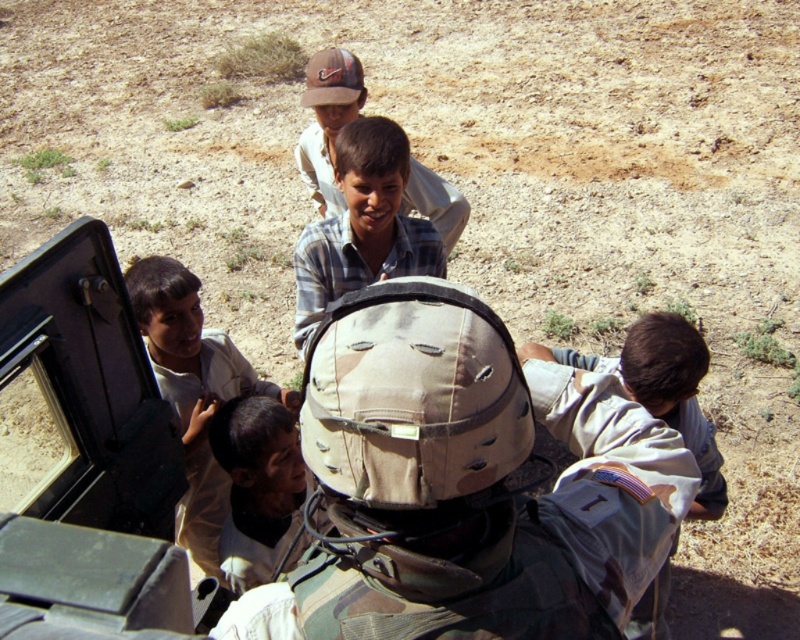
Question: Which of the following is the closest to the observer?

Choices:
 (A) camouflage helmet at center
 (B) plaid shirt at center
 (C) light brown skin at center
 (D) plaid cotton shirt at center

Answer: (A)

Question: Which of these objects is positioned closest to the light brown uniform at center?

Choices:
 (A) plaid cotton shirt at center
 (B) plaid shirt at center

Answer: (A)

Question: Is light brown skin at center in front of plaid cotton shirt at center?

Choices:
 (A) yes
 (B) no

Answer: (A)

Question: Which of the following is the closest to the observer?

Choices:
 (A) plaid cotton shirt at center
 (B) light brown skin at center
 (C) light brown uniform at center
 (D) camouflage helmet at center

Answer: (D)

Question: Does light brown uniform at center appear on the left side of plaid shirt at center?

Choices:
 (A) no
 (B) yes

Answer: (B)

Question: Can you confirm if camouflage helmet at center is positioned to the left of light brown skin at center?

Choices:
 (A) yes
 (B) no

Answer: (B)